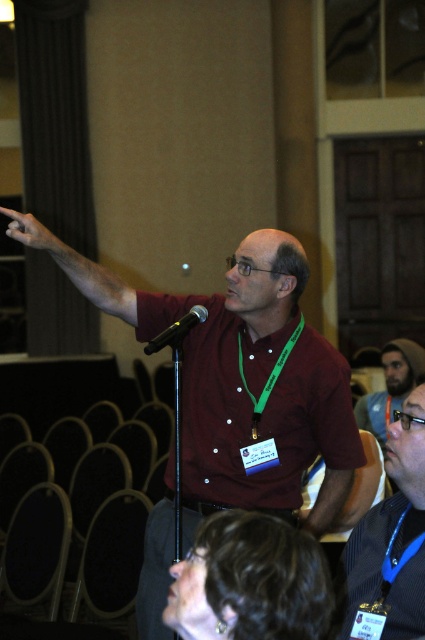
Question: Considering the real-world distances, which object is closest to the dark brown hair at upper right?

Choices:
 (A) blue lanyard at lower right
 (B) matte maroon shirt at center
 (C) matte skin hand at upper left

Answer: (B)

Question: From the image, what is the correct spatial relationship of matte skin hand at upper left in relation to black matte microphone at center?

Choices:
 (A) left
 (B) right

Answer: (A)

Question: Does matte maroon shirt at center have a greater width compared to dark brown hair at lower center?

Choices:
 (A) yes
 (B) no

Answer: (A)

Question: Which is nearer to the matte skin hand at upper left?

Choices:
 (A) dark brown hair at lower center
 (B) blue lanyard at lower right
 (C) matte maroon shirt at center
 (D) dark brown hair at upper right

Answer: (C)

Question: Which of these objects is positioned closest to the dark brown hair at upper right?

Choices:
 (A) matte skin hand at upper left
 (B) matte maroon shirt at center
 (C) blue lanyard at lower right
 (D) dark brown hair at lower center

Answer: (B)

Question: Does matte maroon shirt at center have a greater width compared to dark brown hair at upper right?

Choices:
 (A) yes
 (B) no

Answer: (A)